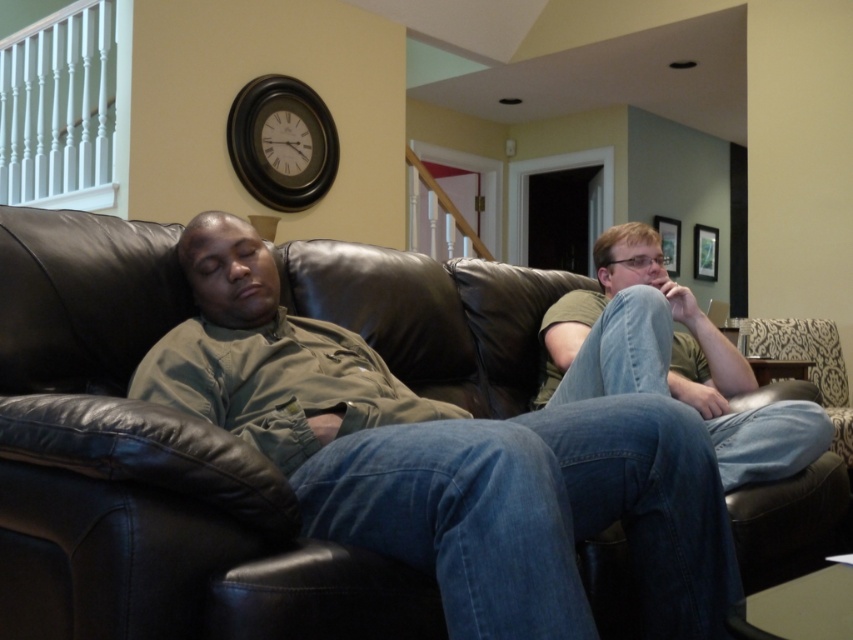
Consider the image. Can you confirm if black leather couch at center is smaller than denim jeans at right?

Indeed, black leather couch at center has a smaller size compared to denim jeans at right.

Based on the photo, is black leather couch at center closer to camera compared to denim jeans at right?

No, it is behind denim jeans at right.

What do you see at coordinates (148, 468) in the screenshot? I see `black leather couch at center` at bounding box center [148, 468].

This screenshot has height=640, width=853. I want to click on black leather couch at center, so click(x=148, y=468).